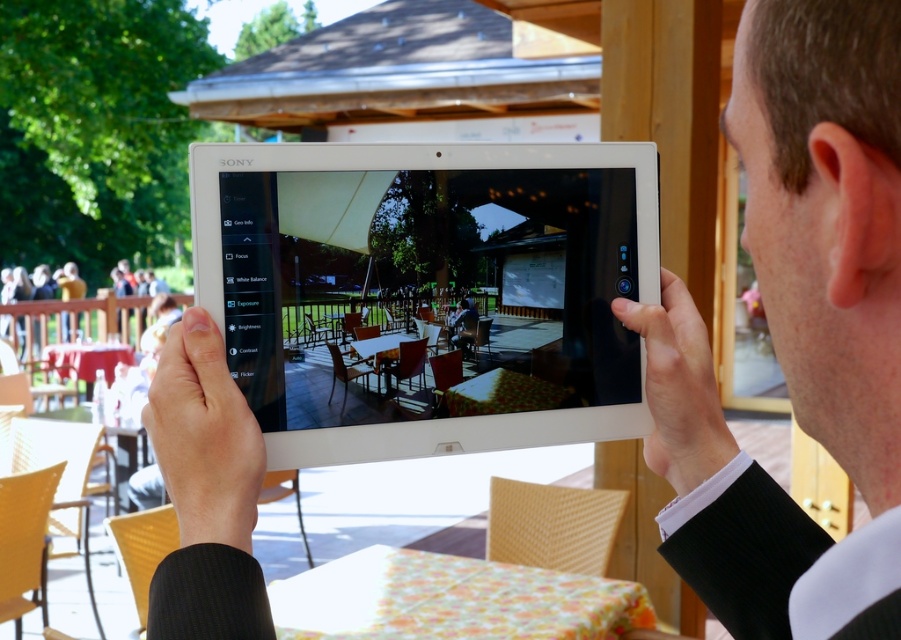
Question: Does smooth skin hand at center appear on the left side of white matte tablet at center?

Choices:
 (A) yes
 (B) no

Answer: (A)

Question: Which point appears farthest from the camera in this image?

Choices:
 (A) (681, 371)
 (B) (179, 524)

Answer: (A)

Question: Which object is the farthest from the white matte tablet at center?

Choices:
 (A) smooth skin hand at center
 (B) smooth black suit at center

Answer: (A)

Question: Which point appears closest to the camera in this image?

Choices:
 (A) (343, 339)
 (B) (199, 464)
 (C) (653, 346)
 (D) (704, 552)

Answer: (B)

Question: Does white glossy tablet at center appear on the right side of white matte tablet at center?

Choices:
 (A) yes
 (B) no

Answer: (B)

Question: Is white glossy tablet at center above smooth skin hand at center?

Choices:
 (A) yes
 (B) no

Answer: (A)